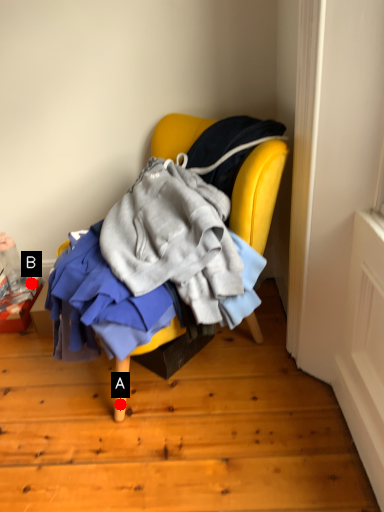
Question: Two points are circled on the image, labeled by A and B beside each circle. Which point is closer to the camera taking this photo?

Choices:
 (A) A is closer
 (B) B is closer

Answer: (A)